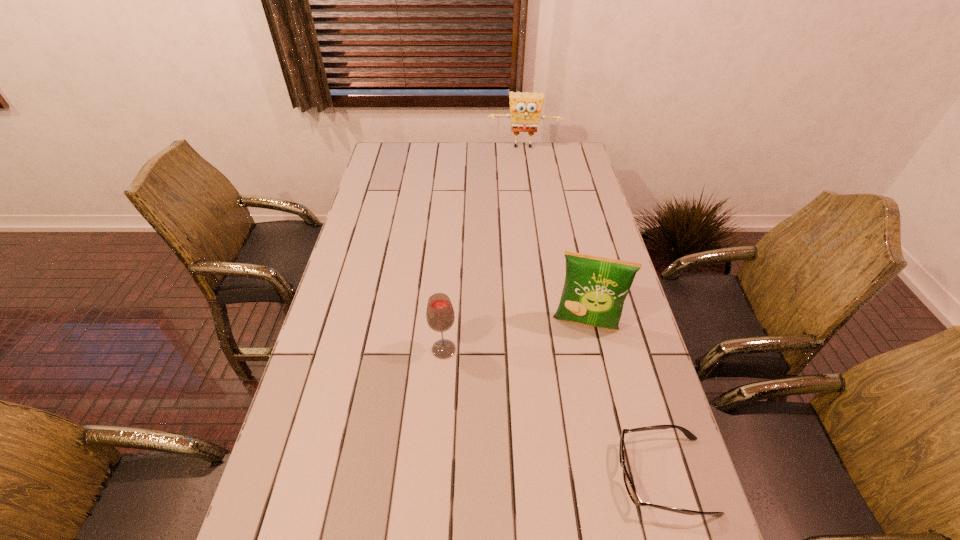
I want to click on free region located 0.280m on the face of the sponge, so click(522, 190).

The height and width of the screenshot is (540, 960). I want to click on free space located on the face of the sponge, so click(522, 169).

This screenshot has width=960, height=540. I want to click on free location located on the face of the sponge, so click(522, 173).

You are a GUI agent. You are given a task and a screenshot of the screen. Output one action in this format:
    pyautogui.click(x=<x>, y=<y>)
    Task: Click on the vacant space situated on the front-facing side of the third nearest object
    Image resolution: width=960 pixels, height=540 pixels.
    Given the screenshot: What is the action you would take?
    pyautogui.click(x=574, y=382)

The width and height of the screenshot is (960, 540). I want to click on vacant space located 0.100m on the front-facing side of the third nearest object, so click(576, 366).

Locate an element on the screen. Image resolution: width=960 pixels, height=540 pixels. vacant space located on the front-facing side of the third nearest object is located at coordinates (567, 429).

Find the location of a particular element. object situated at the far edge is located at coordinates (525, 108).

Find the location of `object present at the near edge`. object present at the near edge is located at coordinates (632, 493).

This screenshot has height=540, width=960. I want to click on spectacles present at the right edge, so click(x=632, y=493).

Where is `sponge that is at the right edge`? This screenshot has width=960, height=540. sponge that is at the right edge is located at coordinates (525, 108).